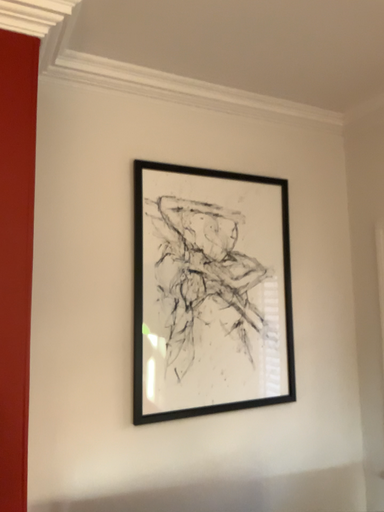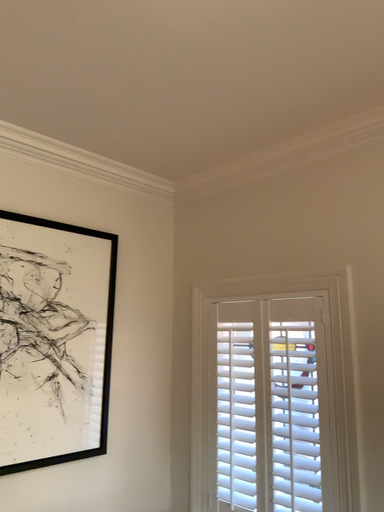
Question: Which way did the camera rotate in the video?

Choices:
 (A) rotated right
 (B) rotated left

Answer: (A)